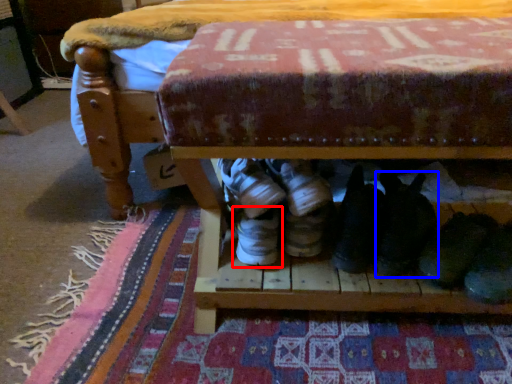
Question: Which object appears closest to the camera in this image, footwear (highlighted by a red box) or footwear (highlighted by a blue box)?

Choices:
 (A) footwear
 (B) footwear

Answer: (A)